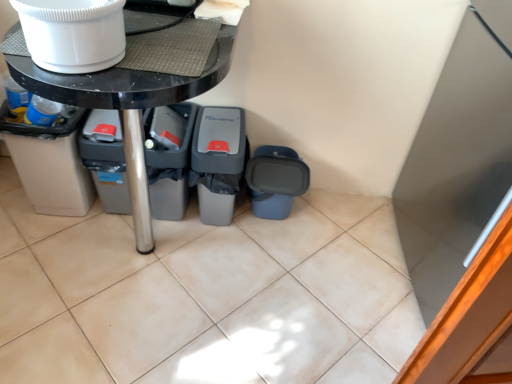
Locate an element on the screen. The image size is (512, 384). free spot to the right of blue matte recycling bin at lower right, which is the 4th recycling bin in left-to-right order is located at coordinates (329, 226).